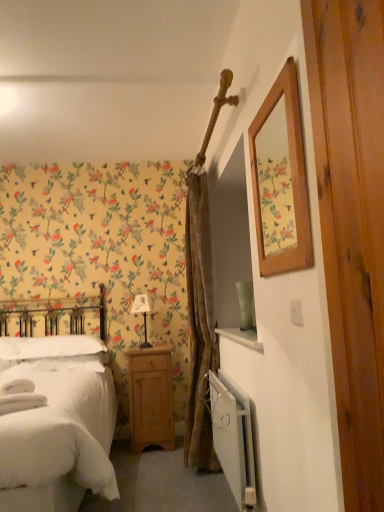
Question: Is white soft bed at left in contact with brown textured curtain at center?

Choices:
 (A) no
 (B) yes

Answer: (A)

Question: Is white soft bed at left aimed at brown textured curtain at center?

Choices:
 (A) yes
 (B) no

Answer: (B)

Question: Is the depth of white soft bed at left greater than that of brown textured curtain at center?

Choices:
 (A) no
 (B) yes

Answer: (A)

Question: Would you say white soft bed at left contains brown textured curtain at center?

Choices:
 (A) yes
 (B) no

Answer: (B)

Question: Can you confirm if white soft bed at left is wider than brown textured curtain at center?

Choices:
 (A) no
 (B) yes

Answer: (B)

Question: In terms of height, does white soft pillow at left look taller or shorter compared to white soft bed at left?

Choices:
 (A) short
 (B) tall

Answer: (A)

Question: From the image's perspective, is white soft pillow at left located above or below white soft bed at left?

Choices:
 (A) below
 (B) above

Answer: (B)

Question: Looking at their shapes, would you say white soft pillow at left is wider or thinner than white soft bed at left?

Choices:
 (A) wide
 (B) thin

Answer: (B)

Question: From a real-world perspective, is white soft pillow at left positioned above or below white soft bed at left?

Choices:
 (A) above
 (B) below

Answer: (A)

Question: Considering the positions of white fabric lampshade at center and white metallic radiator at lower right in the image, is white fabric lampshade at center bigger or smaller than white metallic radiator at lower right?

Choices:
 (A) small
 (B) big

Answer: (A)

Question: Considering the positions of white fabric lampshade at center and white metallic radiator at lower right in the image, is white fabric lampshade at center taller or shorter than white metallic radiator at lower right?

Choices:
 (A) short
 (B) tall

Answer: (A)

Question: From the image's perspective, relative to white metallic radiator at lower right, is white fabric lampshade at center above or below?

Choices:
 (A) above
 (B) below

Answer: (A)

Question: Considering the relative positions of white fabric lampshade at center and white metallic radiator at lower right in the image provided, is white fabric lampshade at center to the left or to the right of white metallic radiator at lower right?

Choices:
 (A) right
 (B) left

Answer: (B)

Question: In the image, is white soft pillow at left on the left side or the right side of light brown wood nightstand at lower center?

Choices:
 (A) right
 (B) left

Answer: (B)

Question: In terms of width, does white soft pillow at left look wider or thinner when compared to light brown wood nightstand at lower center?

Choices:
 (A) wide
 (B) thin

Answer: (A)